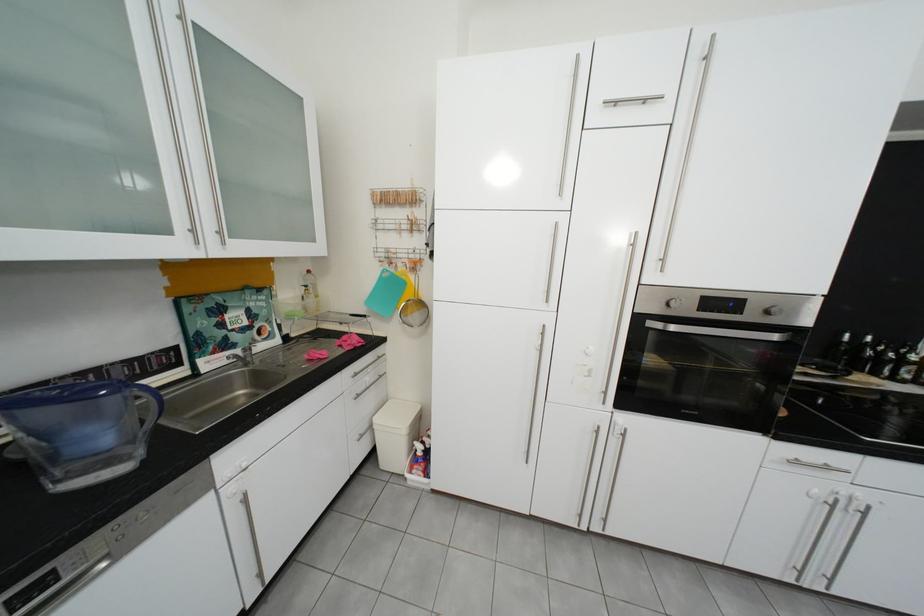
I want to click on silver oven handle, so click(719, 331).